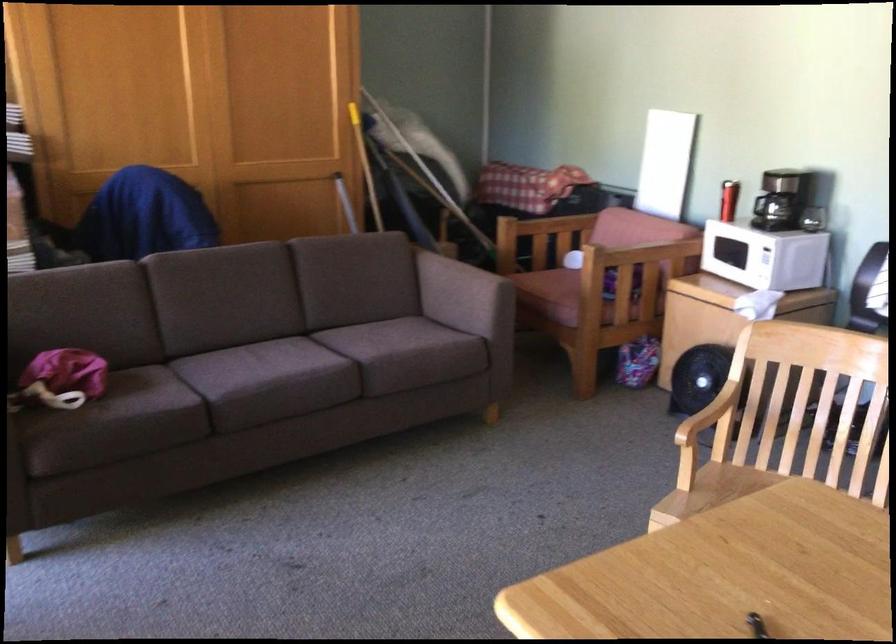
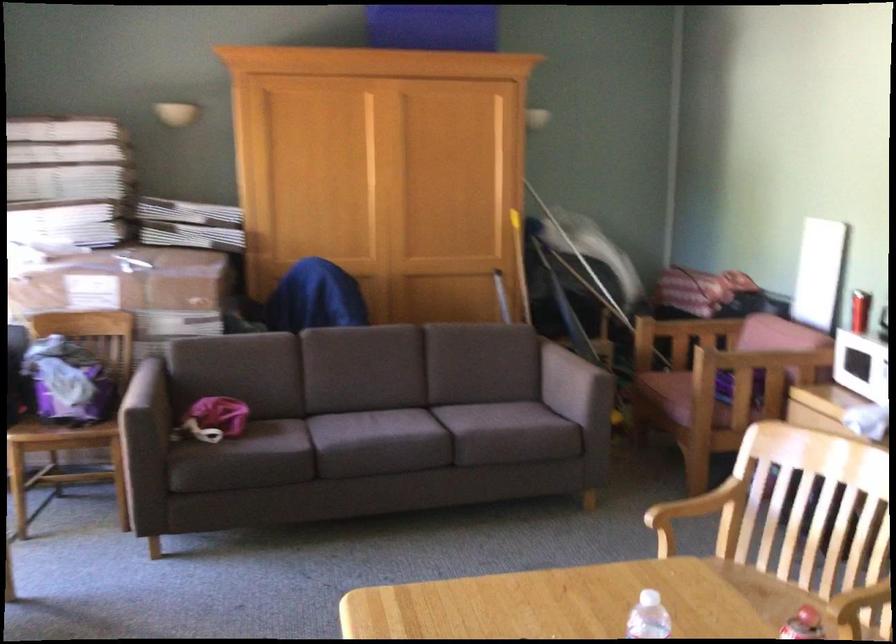
Locate, in the second image, the point that corresponds to pixel 554 297 in the first image.

(669, 393)